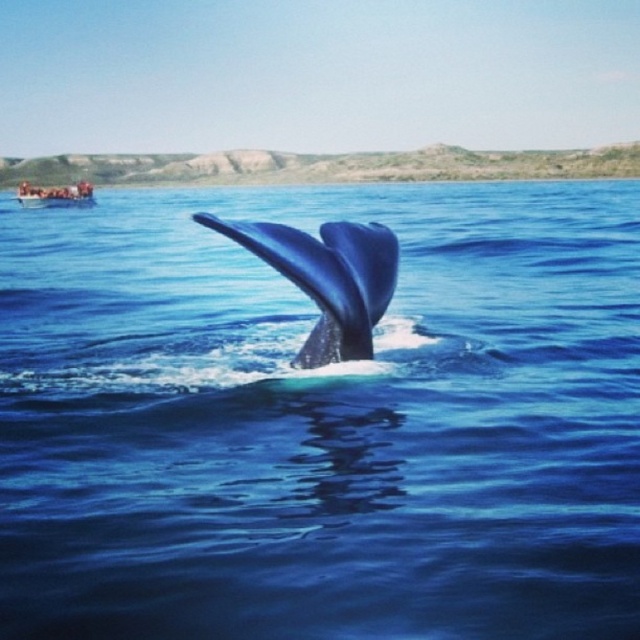
You are standing on the deck of the boat and want to take a photo of the whale. The camera you have can focus on objects within 4 meters. Is the point where the whale is located at point (77, 433) within the camera focus range?

The distance of point (77, 433) from the camera is 3.98 meters, so yes, the whale at point (77, 433) is within the camera focus range since it is less than 4 meters away.

You are standing on a boat watching a whale. The boat is on the left side of the image. There is a point at coordinates point (358, 244). If you want to throw a biodegradable snack to the whale, which is in the center, should you aim towards the point or away from it?

The point (358, 244) is 13.34 feet from the viewer. Since the whale is in the center and the point is closer than the whale, you should aim away from the point to reach the whale.

You are a photographer trying to capture the whale and the boat in the same frame. Given the scene described, can you fit both the shiny blue whale at center and the blue smooth water at center into your camera viewfinder without cropping either object?

The blue smooth water at center is taller than the shiny blue whale at center, so yes, both can be captured in the same frame as the water provides enough vertical space to include the whale without cropping.